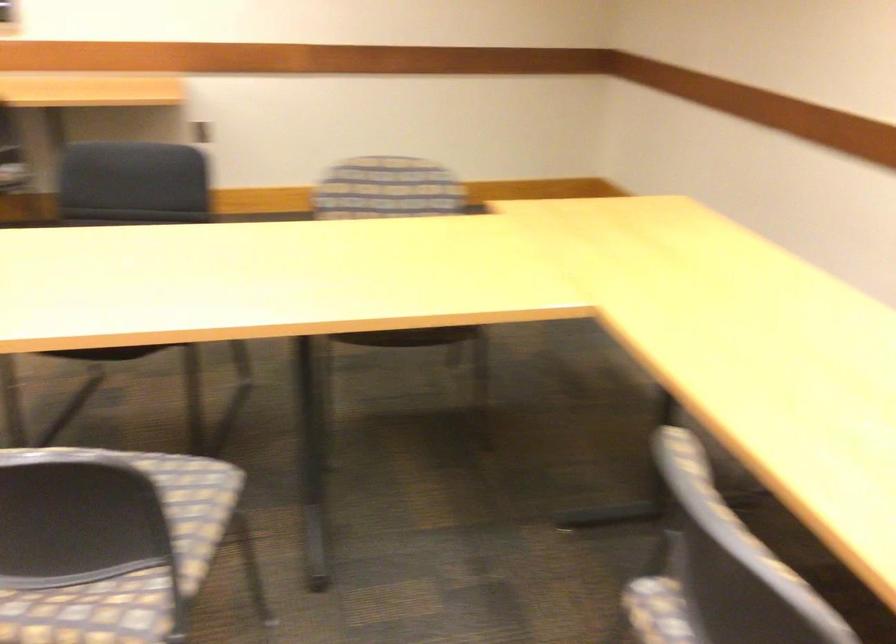
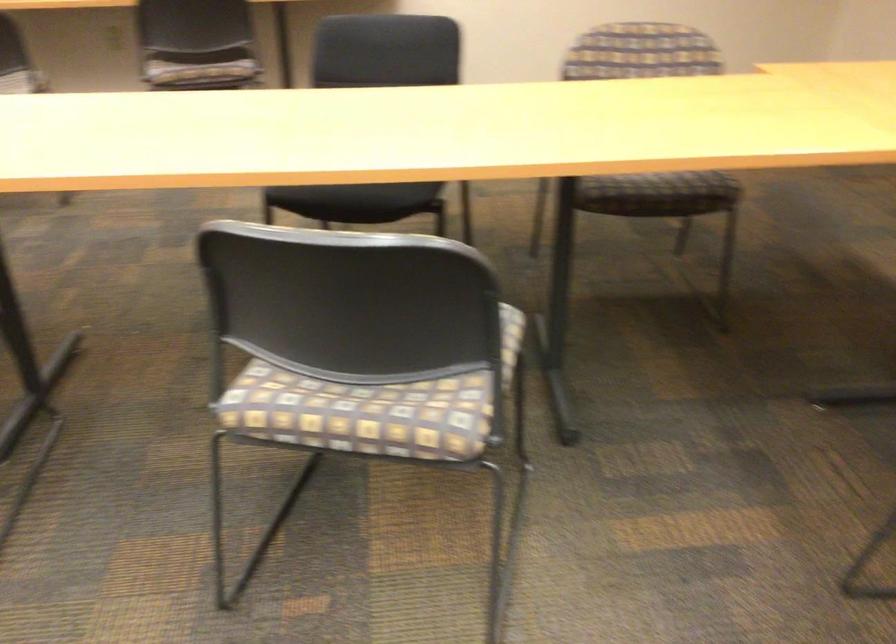
Question: The camera is either moving clockwise (left) or counter-clockwise (right) around the object. The first image is from the beginning of the video and the second image is from the end. Is the camera moving left or right when shooting the video?

Choices:
 (A) Left
 (B) Right

Answer: (B)